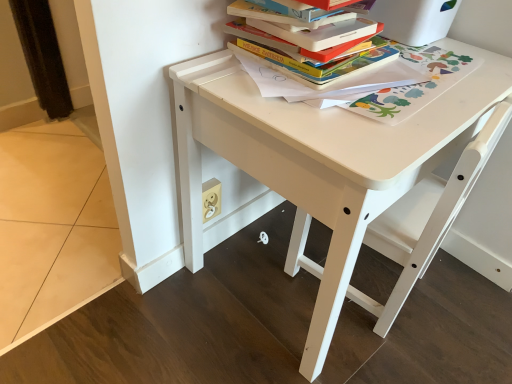
This screenshot has width=512, height=384. Identify the location of blank space situated above white matte table at center (from a real-world perspective). (356, 80).